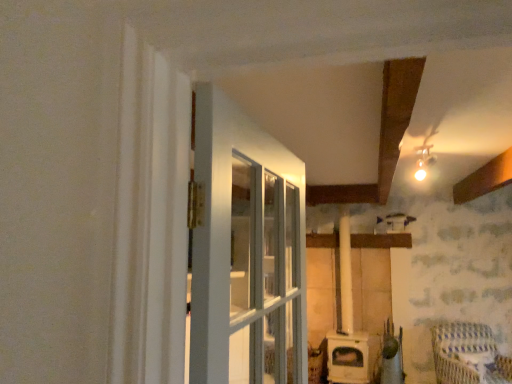
The height and width of the screenshot is (384, 512). What are the coordinates of `woven fabric armchair at lower right` in the screenshot? It's located at (468, 355).

Describe the element at coordinates (468, 355) in the screenshot. This screenshot has width=512, height=384. I see `woven fabric armchair at lower right` at that location.

The height and width of the screenshot is (384, 512). I want to click on woven fabric armchair at lower right, so click(468, 355).